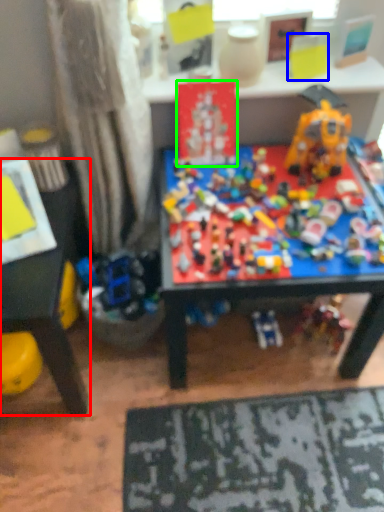
Question: Which object is the farthest from table (highlighted by a red box)? Choose among these: toy (highlighted by a blue box) or toy (highlighted by a green box).

Choices:
 (A) toy
 (B) toy

Answer: (A)